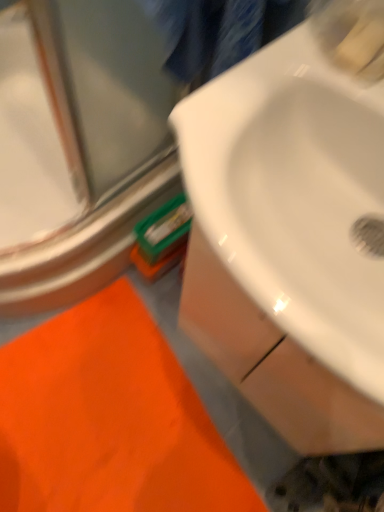
Locate an element on the screen. This screenshot has height=512, width=384. vacant space underneath orange fabric bath mat at lower left (from a real-world perspective) is located at coordinates (103, 421).